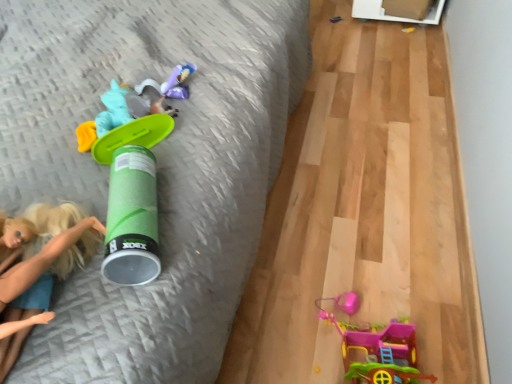
Locate an element on the screen. The image size is (512, 384). vacant area located to the right-hand side of metallic silver toy at upper right, marked as the fifth toy in a front-to-back arrangement is located at coordinates (371, 22).